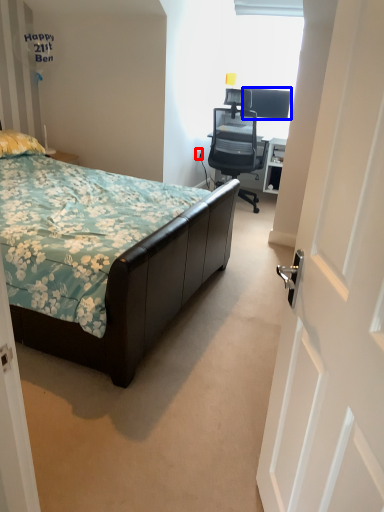
Question: Which of the following is the closest to the observer, power outlet (highlighted by a red box) or television (highlighted by a blue box)?

Choices:
 (A) power outlet
 (B) television

Answer: (B)